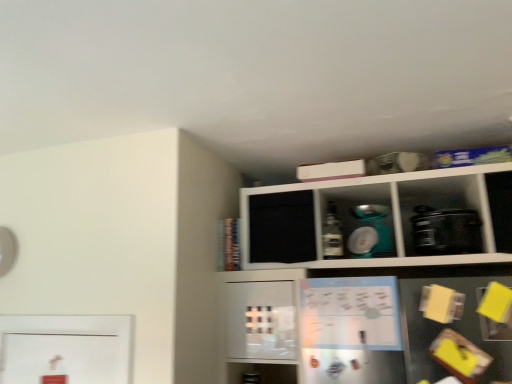
Question: Is matte plastic bottle at center behind black plastic toaster at right, which is the 2th appliance from left to right?

Choices:
 (A) no
 (B) yes

Answer: (B)

Question: Does matte plastic bottle at center have a larger size compared to black plastic toaster at right, which is the 2th appliance from left to right?

Choices:
 (A) no
 (B) yes

Answer: (A)

Question: Is matte plastic bottle at center directly adjacent to black plastic toaster at right, placed as the 1th appliance when sorted from right to left?

Choices:
 (A) no
 (B) yes

Answer: (A)

Question: From a real-world perspective, is matte plastic bottle at center physically above black plastic toaster at right, which is the 2th appliance from left to right?

Choices:
 (A) no
 (B) yes

Answer: (B)

Question: From a real-world perspective, is matte plastic bottle at center beneath black plastic toaster at right, placed as the 1th appliance when sorted from right to left?

Choices:
 (A) no
 (B) yes

Answer: (A)

Question: From the image's perspective, relative to white matte cabinet at upper center, is matte white bowl at upper center, which is the 1th appliance in left-to-right order, above or below?

Choices:
 (A) below
 (B) above

Answer: (B)

Question: From a real-world perspective, relative to white matte cabinet at upper center, is matte white bowl at upper center, acting as the 2th appliance starting from the right, vertically above or below?

Choices:
 (A) above
 (B) below

Answer: (A)

Question: Based on their sizes in the image, would you say matte white bowl at upper center, which is the 1th appliance in left-to-right order, is bigger or smaller than white matte cabinet at upper center?

Choices:
 (A) small
 (B) big

Answer: (A)

Question: Considering the positions of matte white bowl at upper center, acting as the 2th appliance starting from the right, and white matte cabinet at upper center in the image, is matte white bowl at upper center, acting as the 2th appliance starting from the right, taller or shorter than white matte cabinet at upper center?

Choices:
 (A) tall
 (B) short

Answer: (B)

Question: Is white matte cabinet at upper center spatially inside matte white bowl at upper center, which is the 1th appliance in left-to-right order, or outside of it?

Choices:
 (A) outside
 (B) inside

Answer: (A)

Question: From the image's perspective, is white matte cabinet at upper center above or below matte white bowl at upper center, which is the 1th appliance in left-to-right order?

Choices:
 (A) above
 (B) below

Answer: (B)

Question: Considering the positions of point (376, 311) and point (360, 231), is point (376, 311) closer or farther from the camera than point (360, 231)?

Choices:
 (A) farther
 (B) closer

Answer: (B)

Question: Considering the relative positions of white matte cabinet at upper center and matte white bowl at upper center, which is the 1th appliance in left-to-right order, in the image provided, is white matte cabinet at upper center to the left or to the right of matte white bowl at upper center, which is the 1th appliance in left-to-right order,?

Choices:
 (A) right
 (B) left

Answer: (A)

Question: In terms of size, does black plastic toaster at right, which is the 2th appliance from left to right, appear bigger or smaller than matte plastic bottle at center?

Choices:
 (A) small
 (B) big

Answer: (B)

Question: Looking at their shapes, would you say black plastic toaster at right, placed as the 1th appliance when sorted from right to left, is wider or thinner than matte plastic bottle at center?

Choices:
 (A) wide
 (B) thin

Answer: (A)